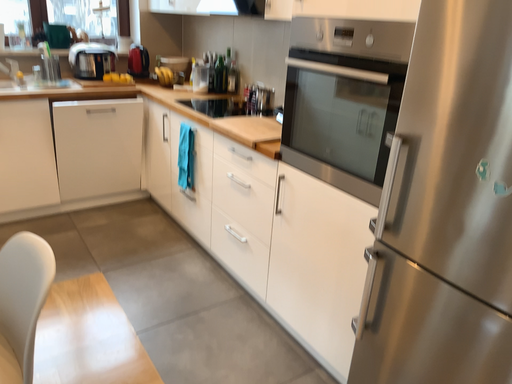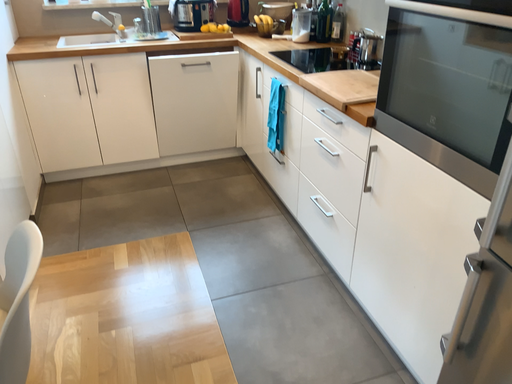
Question: How did the camera likely rotate when shooting the video?

Choices:
 (A) rotated downward
 (B) rotated upward

Answer: (A)